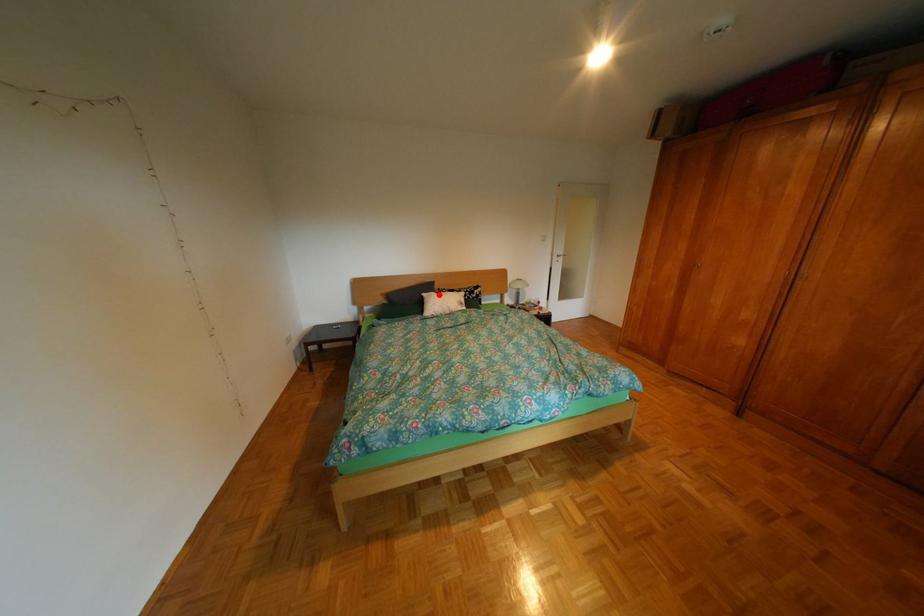
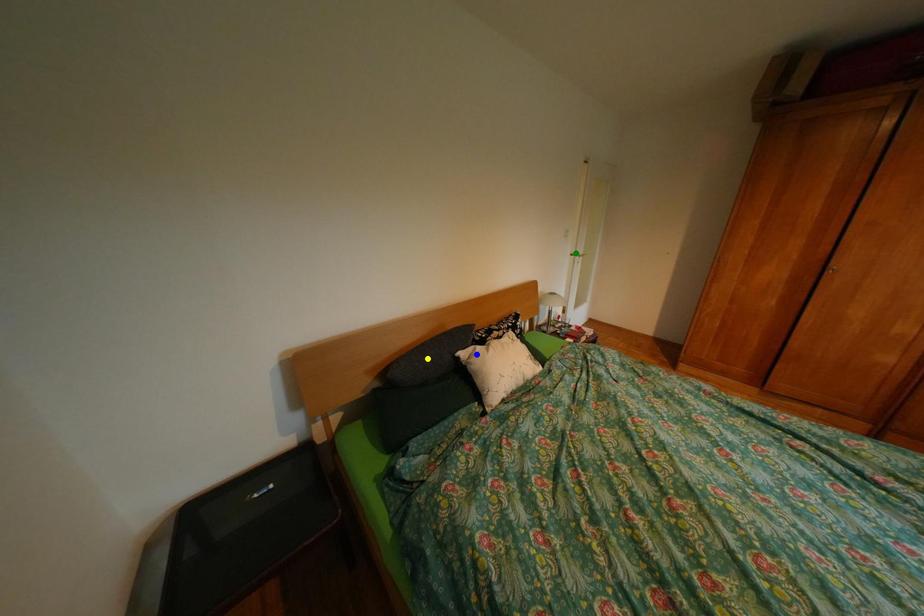
Question: I am providing you with two images of the same scene from different viewpoints. A red point is marked on the first image. You are given multiple points on the second image. Which mark in image 2 goes with the point in image 1?

Choices:
 (A) green point
 (B) yellow point
 (C) blue point

Answer: (C)